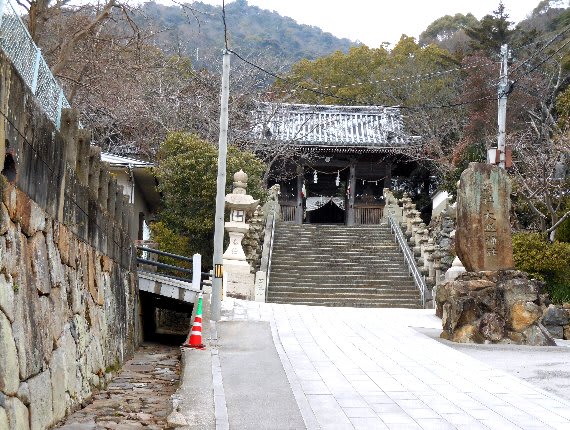
Image resolution: width=570 pixels, height=430 pixels. I want to click on stairs, so click(321, 263).